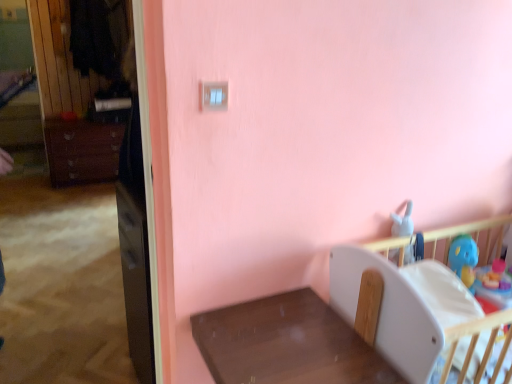
Question: Looking at their shapes, would you say white plastic infant bed at lower right is wider or thinner than matte brown dresser at left?

Choices:
 (A) thin
 (B) wide

Answer: (B)

Question: Considering their positions, is white plastic infant bed at lower right located in front of or behind matte brown dresser at left?

Choices:
 (A) front
 (B) behind

Answer: (A)

Question: Based on their relative distances, which object is farther from the matte brown dresser at left?

Choices:
 (A) brown wooden table at lower center
 (B) matte black file cabinet at left
 (C) blue rubber duck at right
 (D) white plastic infant bed at lower right

Answer: (C)

Question: Which is nearer to the matte brown dresser at left?

Choices:
 (A) white plastic infant bed at lower right
 (B) matte black file cabinet at left
 (C) blue rubber duck at right
 (D) brown wooden table at lower center

Answer: (B)